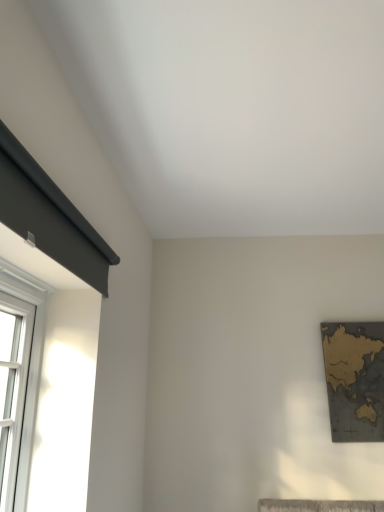
What is the approximate width of gold metallic map at right?

gold metallic map at right is 1.56 inches wide.

Describe the element at coordinates (355, 380) in the screenshot. I see `gold metallic map at right` at that location.

You are a GUI agent. You are given a task and a screenshot of the screen. Output one action in this format:
    pyautogui.click(x=<x>, y=<y>)
    Task: Click on the gold metallic map at right
    Image resolution: width=384 pixels, height=512 pixels.
    Given the screenshot: What is the action you would take?
    pyautogui.click(x=355, y=380)

This screenshot has height=512, width=384. Find the location of `gold metallic map at right`. gold metallic map at right is located at coordinates (355, 380).